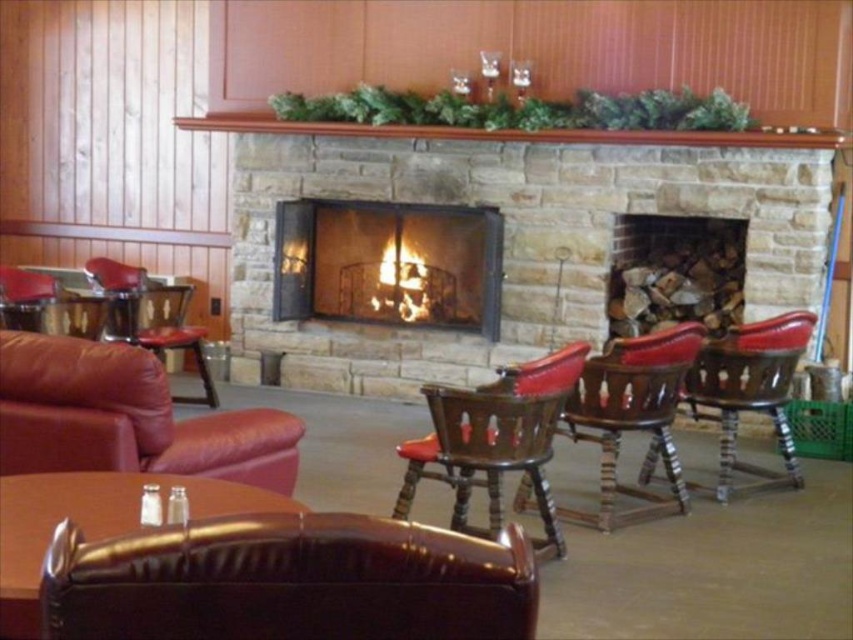
Does brown leather swivel chair at center have a larger size compared to leather seat at center?

No, brown leather swivel chair at center is not bigger than leather seat at center.

At what (x,y) coordinates should I click in order to perform the action: click on brown leather swivel chair at center. Please return your answer as a coordinate pair (x, y). Looking at the image, I should click on (289, 580).

Identify the location of brown leather swivel chair at center. (289, 580).

Can you confirm if brown leather swivel chair at center is positioned above stone fireplace at center?

No.

Does brown leather swivel chair at center lie in front of stone fireplace at center?

Yes, it is in front of stone fireplace at center.

Measure the distance between point (189, 614) and camera.

Point (189, 614) and camera are 1.40 meters apart from each other.

Find the location of a particular element. brown leather swivel chair at center is located at coordinates (289, 580).

Which of these two, leather armchair at center or leather barstool at right, stands taller?

leather barstool at right

Which is above, leather armchair at center or leather barstool at right?

leather barstool at right

Where is `leather armchair at center`? leather armchair at center is located at coordinates (631, 419).